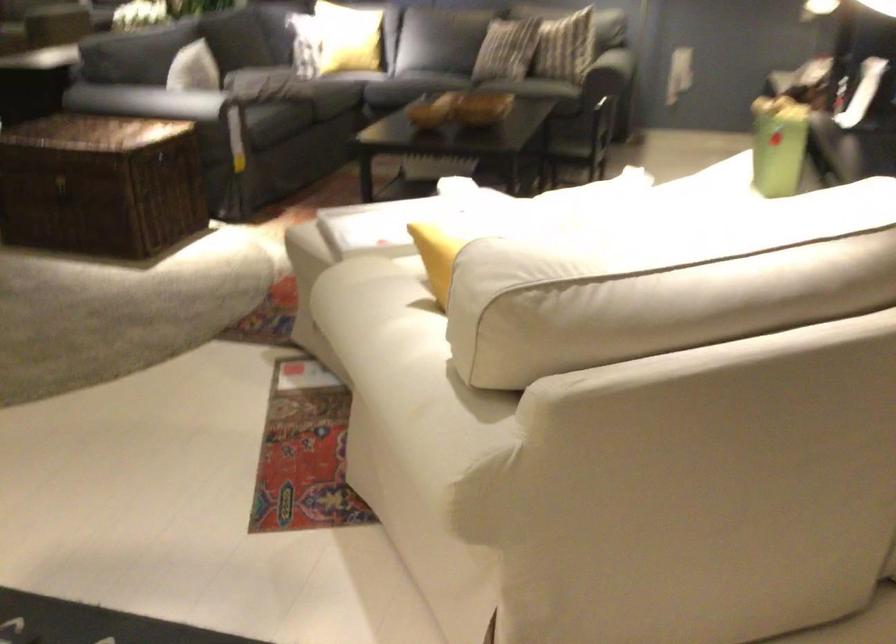
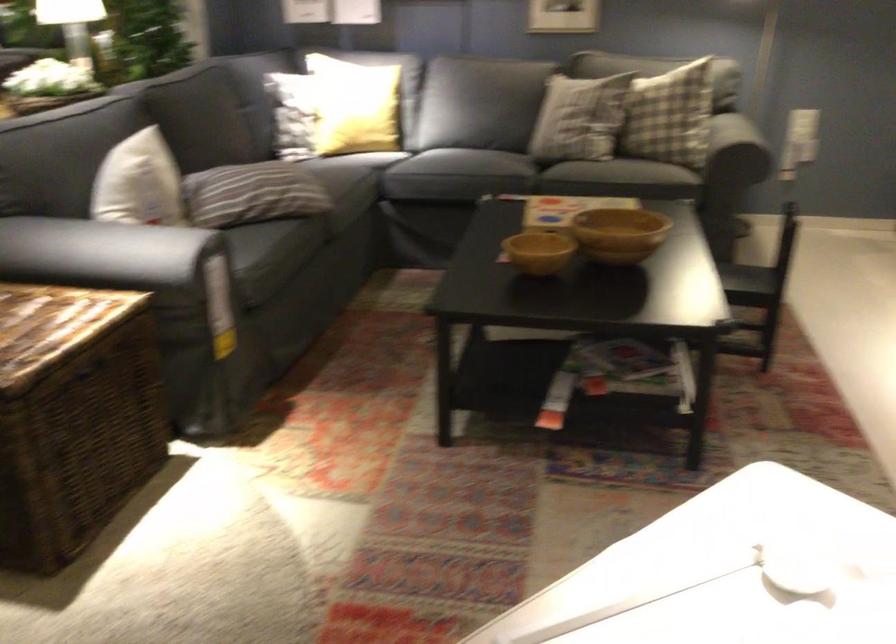
Locate, in the second image, the point that corresponds to [148,127] in the first image.

(55, 317)